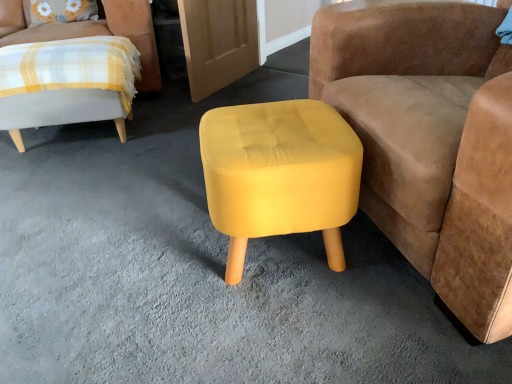
Where is `free space above yellow fabric stool at center (from a real-world perspective)`? This screenshot has width=512, height=384. free space above yellow fabric stool at center (from a real-world perspective) is located at coordinates (274, 128).